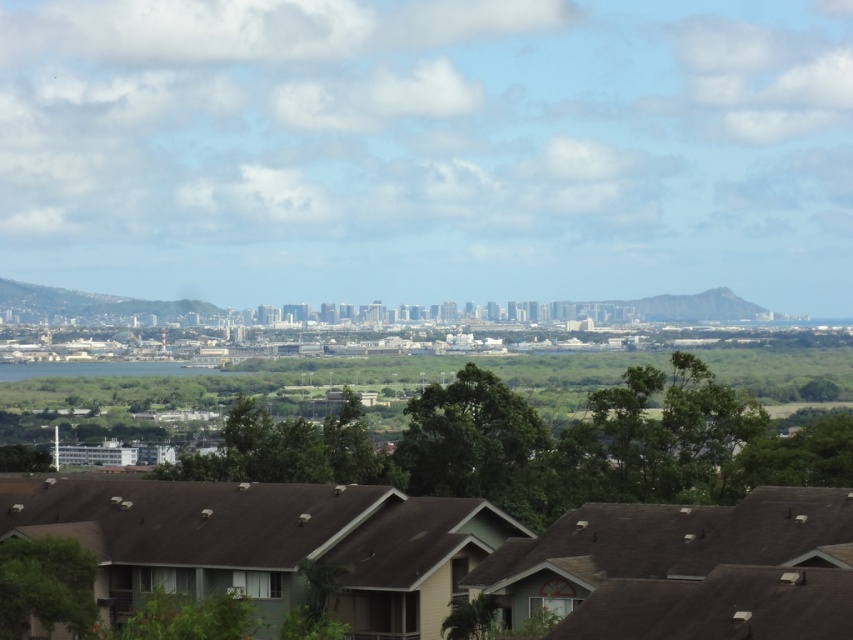
You are standing in the city park and see the green leafy tree at center and the green leafy tree at lower left. Which tree is located to the left of the other?

The green leafy tree at lower left is positioned to the left of the green leafy tree at center.

You are standing at the center of the cityscape image. You want to walk towards the green leafy tree at center. Which direction should you move relative to your current position?

The green leafy tree at center is located at coordinates point (469, 438), so you should move towards the direction of the coordinates to reach it.

You are planning to plant a new tree in your backyard. You have two options based on the image you see. The first is the green leafy tree at center and the second is the green leafy tree at lower left. Which tree should you choose if you want a taller tree?

The green leafy tree at center is much taller than the green leafy tree at lower left, so you should choose the green leafy tree at center if you want a taller tree.